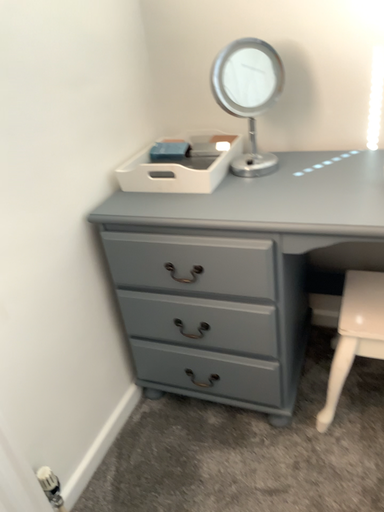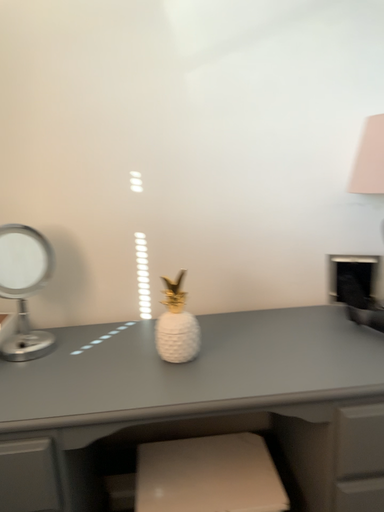
Question: How did the camera likely rotate when shooting the video?

Choices:
 (A) rotated upward
 (B) rotated downward

Answer: (A)